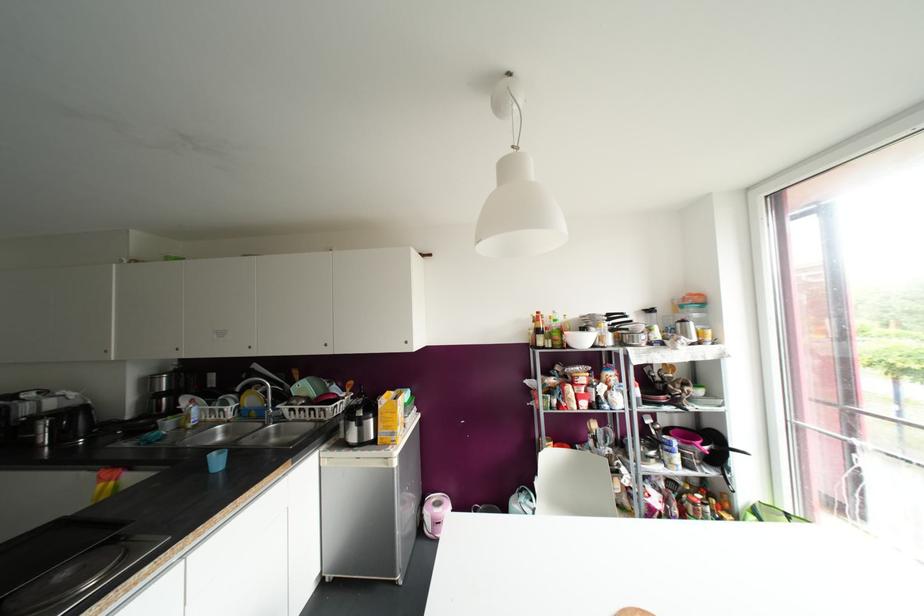
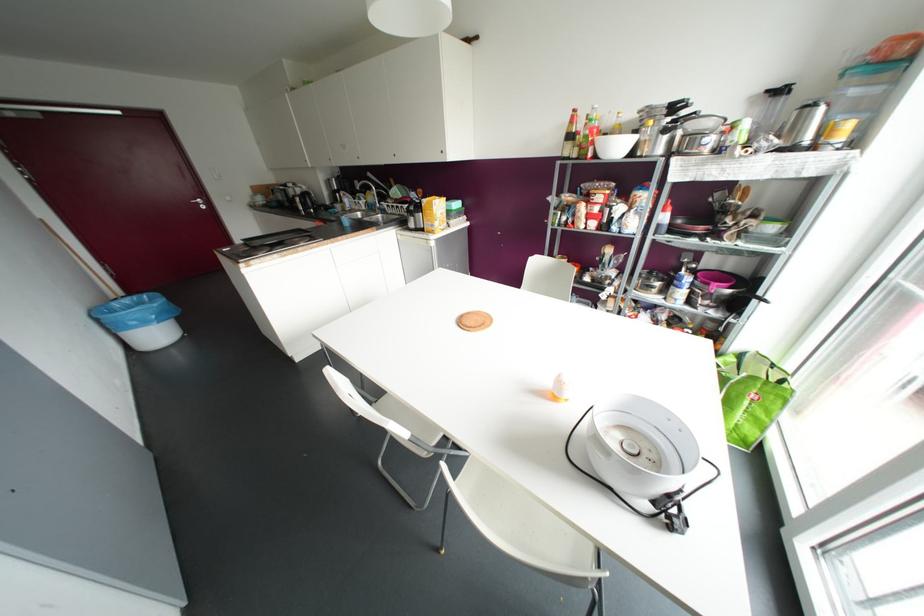
In the second image, find the point that corresponds to point (610, 315) in the first image.

(673, 107)